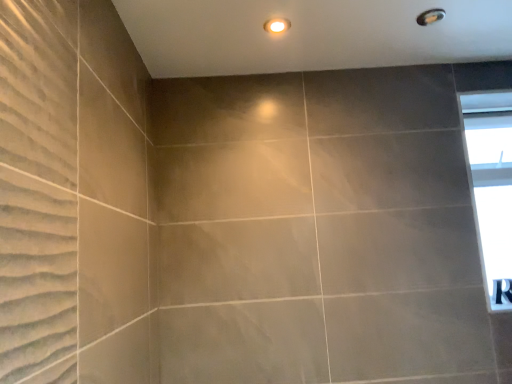
Question: Based on their positions, is matte gray shower at upper right located to the left or right of transparent glass window at upper right?

Choices:
 (A) left
 (B) right

Answer: (A)

Question: From a real-world perspective, relative to transparent glass window at upper right, is matte gray shower at upper right vertically above or below?

Choices:
 (A) above
 (B) below

Answer: (A)

Question: Which object is positioned closest to the matte gray shower at upper right?

Choices:
 (A) transparent glass window at upper right
 (B) matte white light fixture at upper center

Answer: (B)

Question: Which object is positioned closest to the matte gray shower at upper right?

Choices:
 (A) matte white light fixture at upper center
 (B) transparent glass window at upper right

Answer: (A)